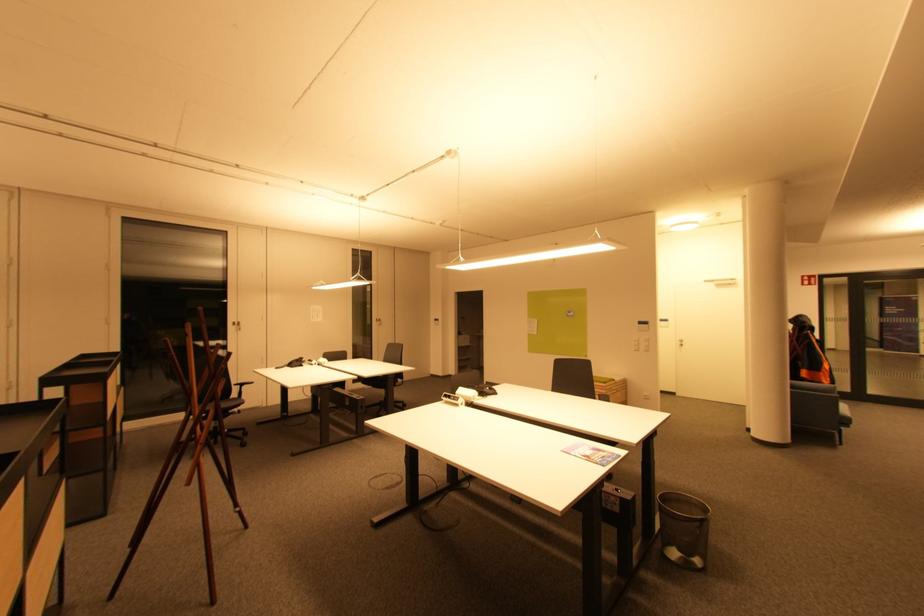
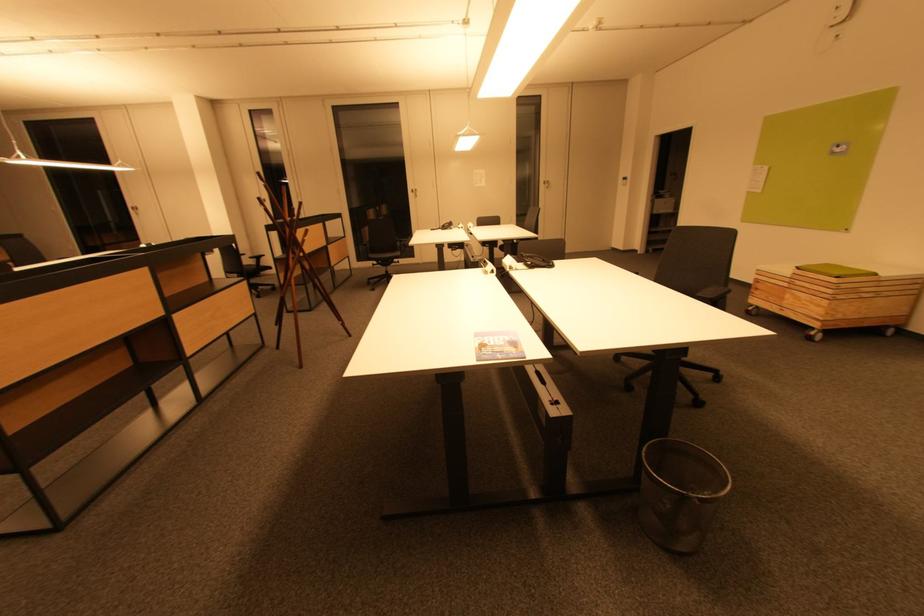
Find the pixel in the second image that matches point 495,394 in the first image.

(548, 265)